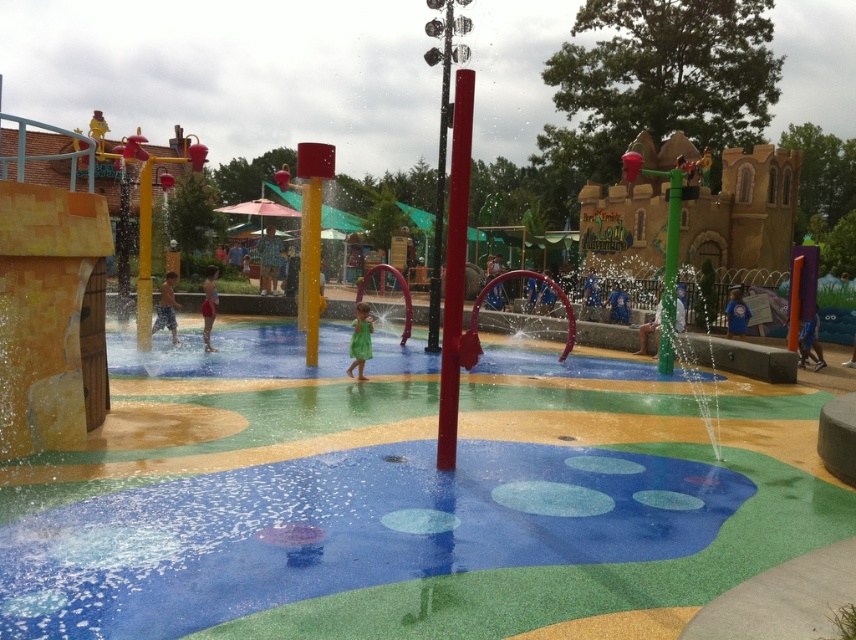
Question: Which of the following is the farthest from the observer?

Choices:
 (A) green fabric dress at center
 (B) green matte dress at center

Answer: (A)

Question: Which point is closer to the camera taking this photo?

Choices:
 (A) (174, 342)
 (B) (360, 353)

Answer: (B)

Question: Is the position of green matte dress at center more distant than that of green fabric dress at center?

Choices:
 (A) no
 (B) yes

Answer: (A)

Question: Which of these objects is positioned farthest from the green fabric dress at center?

Choices:
 (A) green matte dress at center
 (B) smooth tan skin at center

Answer: (A)

Question: Can you confirm if green matte dress at center is smaller than green fabric dress at center?

Choices:
 (A) yes
 (B) no

Answer: (A)

Question: Can you confirm if green matte dress at center is positioned above green fabric dress at center?

Choices:
 (A) yes
 (B) no

Answer: (B)